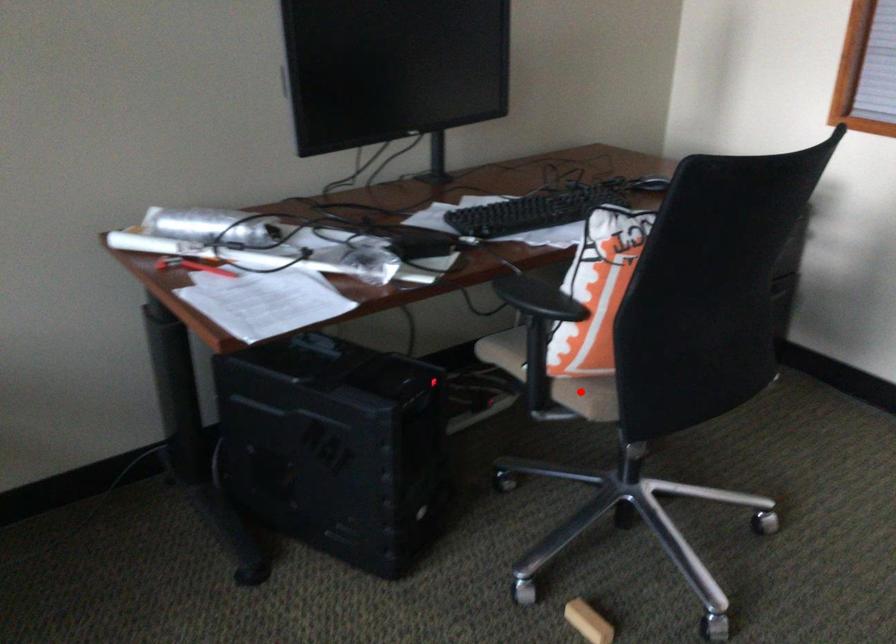
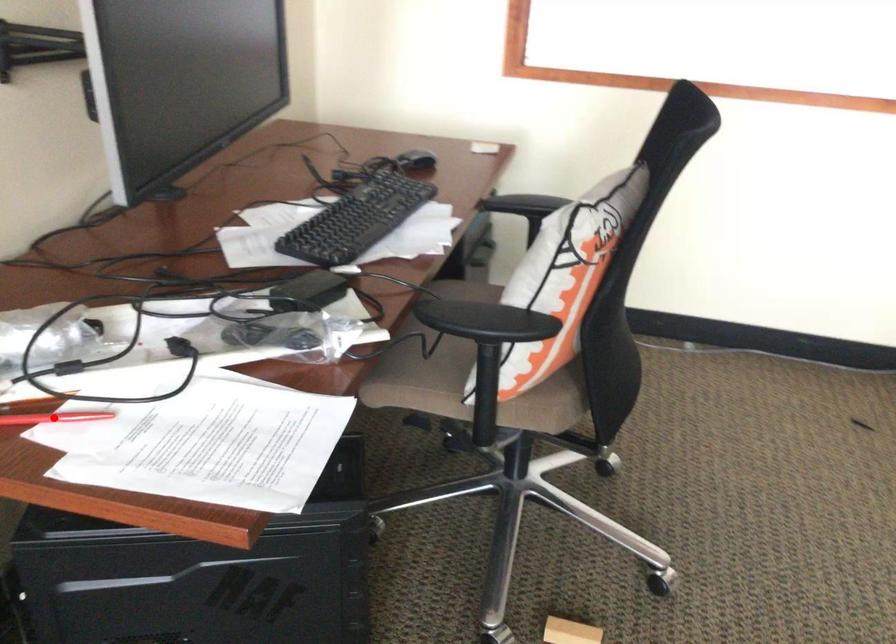
Consider the image. I am providing you with two images of the same scene from different viewpoints. A red point is marked on the first image and another point is marked on the second image. Are the points marked in image1 and image2 representing the same 3D position?

No